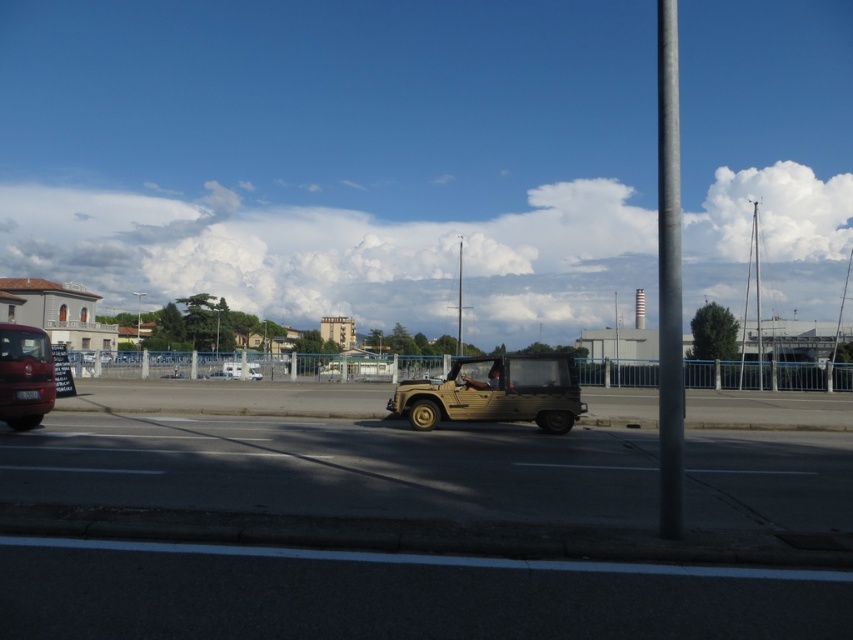
Question: Which point is farther from the camera taking this photo?

Choices:
 (A) (16, 385)
 (B) (521, 403)

Answer: (B)

Question: Is matte khaki jeep at center positioned in front of shiny red bus at left?

Choices:
 (A) yes
 (B) no

Answer: (B)

Question: Which point is farther to the camera?

Choices:
 (A) smooth gray pole at right
 (B) shiny red bus at left

Answer: (B)

Question: Can you confirm if smooth gray pole at right is bigger than matte khaki jeep at center?

Choices:
 (A) yes
 (B) no

Answer: (A)

Question: Estimate the real-world distances between objects in this image. Which object is farther from the shiny red bus at left?

Choices:
 (A) matte khaki jeep at center
 (B) smooth gray pole at right

Answer: (B)

Question: Is smooth gray pole at right wider than matte khaki jeep at center?

Choices:
 (A) yes
 (B) no

Answer: (A)